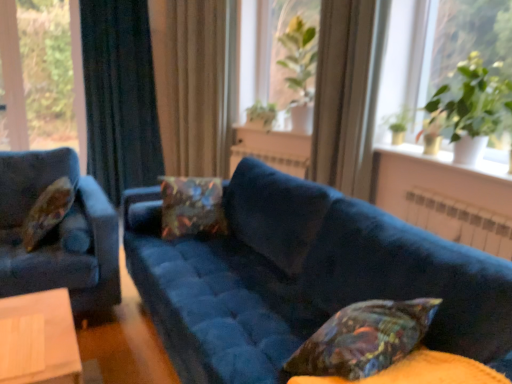
Question: Does point (265, 119) appear closer or farther from the camera than point (400, 152)?

Choices:
 (A) closer
 (B) farther

Answer: (B)

Question: Is green leafy plant at center, which is counted as the 2th plant, starting from the left, wider or thinner than white ceramic vase at upper right?

Choices:
 (A) wide
 (B) thin

Answer: (B)

Question: Estimate the real-world distances between objects in this image. Which object is farther from the green leafy plant at upper right?

Choices:
 (A) velvet blue couch at center
 (B) white metallic radiator at center
 (C) green leafy plant at center, the 3th plant viewed from the back
 (D) velvet-like multicolored pillow at lower right, which is the 3th pillow from back to front
 (E) floral-patterned fabric pillow at center, which appears as the 2th pillow when viewed from the right

Answer: (D)

Question: Which object is positioned farthest from the green leafy plant at center, the 2th plant from the front?

Choices:
 (A) white ceramic vase at upper right
 (B) green leafy plant at center, which is counted as the 2th plant, starting from the left
 (C) beige fabric curtain at center, which is counted as the second curtain, starting from the left
 (D) velvet blue couch at center
 (E) dark blue velvet curtain at left, the first curtain in the left-to-right sequence

Answer: (D)